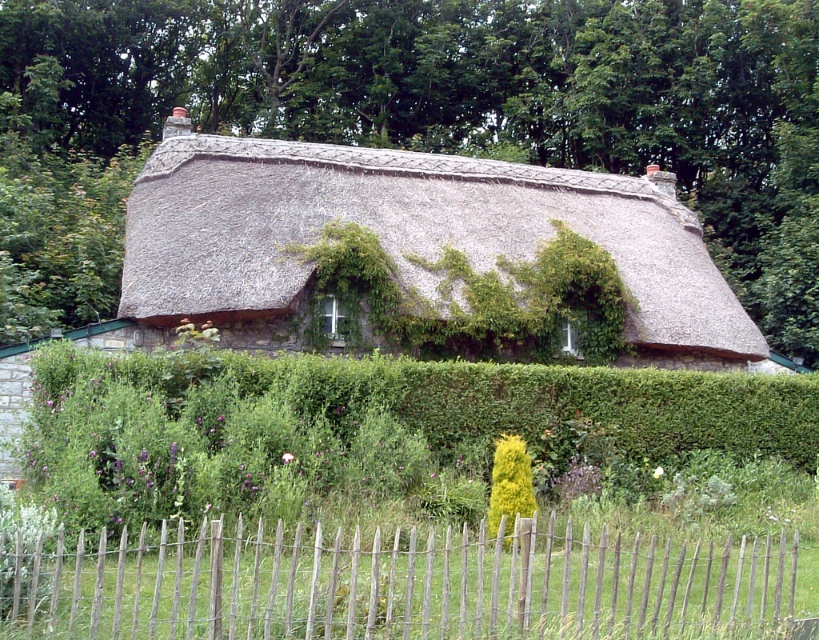
Between green leafy hedge at center and wooden picket fence at lower center, which one appears on the left side from the viewer's perspective?

green leafy hedge at center is more to the left.

Where is `green leafy hedge at center`? green leafy hedge at center is located at coordinates (369, 426).

Can you confirm if green leafy hedge at center is positioned below thatched roof cottage at center?

Correct, green leafy hedge at center is located below thatched roof cottage at center.

Who is higher up, green leafy hedge at center or thatched roof cottage at center?

thatched roof cottage at center is above.

Where is `green leafy hedge at center`? The height and width of the screenshot is (640, 819). green leafy hedge at center is located at coordinates (369, 426).

In the scene shown: Is thatched roof cottage at center taller than wooden picket fence at lower center?

Correct, thatched roof cottage at center is much taller as wooden picket fence at lower center.

Consider the image. Between thatched roof cottage at center and wooden picket fence at lower center, which one appears on the right side from the viewer's perspective?

Positioned to the right is wooden picket fence at lower center.

Is point (426, 196) closer to viewer compared to point (474, 625)?

No.

What are the coordinates of `thatched roof cottage at center` in the screenshot? It's located at (405, 236).